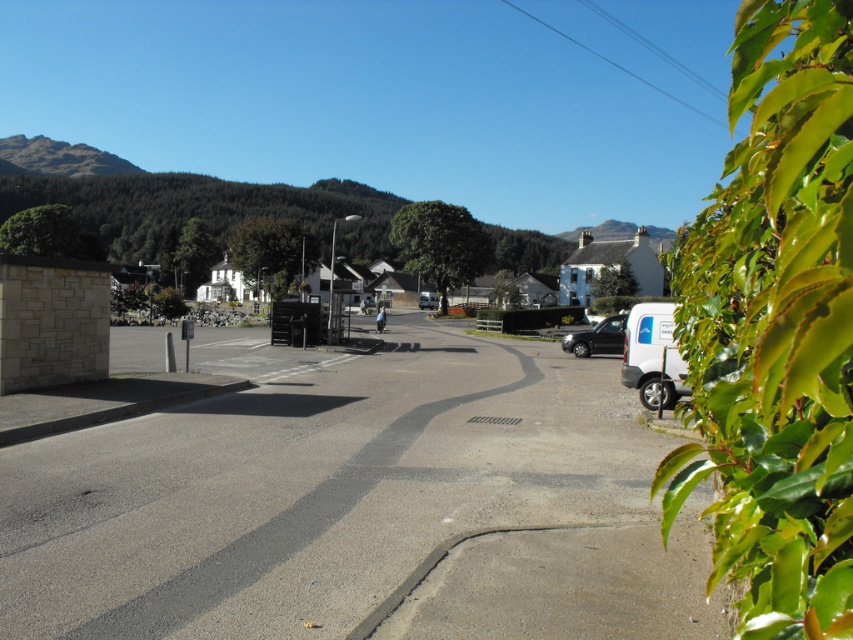
Does point (817, 554) come closer to viewer compared to point (422, 307)?

Yes, it is in front of point (422, 307).

Locate an element on the screen. This screenshot has height=640, width=853. green leafy hedge at right is located at coordinates (776, 328).

Image resolution: width=853 pixels, height=640 pixels. In order to click on green leafy hedge at right in this screenshot , I will do `click(776, 328)`.

Is green leafy hedge at right closer to camera compared to shiny black car at center?

Yes, it is in front of shiny black car at center.

Where is `green leafy hedge at right`? green leafy hedge at right is located at coordinates (776, 328).

Between shiny black car at center and white matte van at center, which one has more height?

white matte van at center is taller.

Between point (614, 332) and point (432, 296), which one is positioned in front?

Point (614, 332) is in front.

Is point (569, 349) farther from viewer compared to point (437, 301)?

No.

Identify the location of shiny black car at center. This screenshot has height=640, width=853. (596, 337).